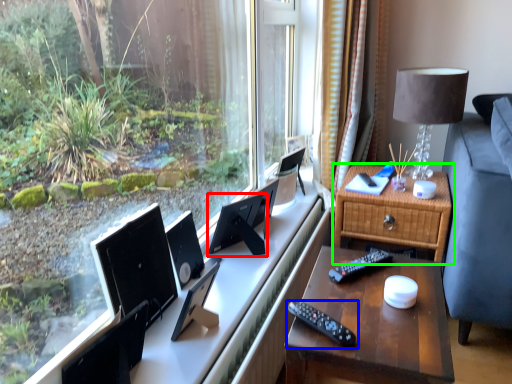
Question: Estimate the real-world distances between objects in this image. Which object is farther from computer monitor (highlighted by a red box), remote control (highlighted by a blue box) or nightstand (highlighted by a green box)?

Choices:
 (A) remote control
 (B) nightstand

Answer: (A)